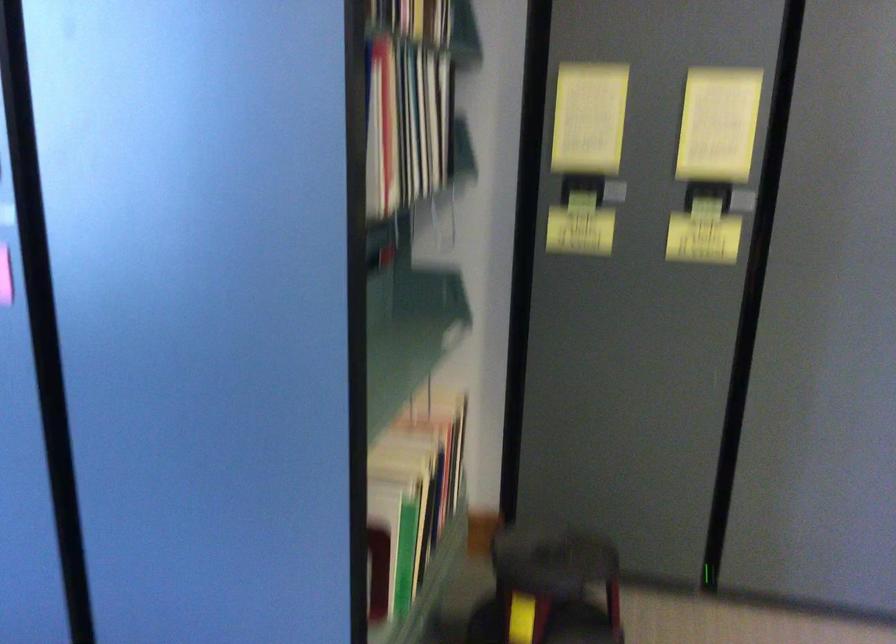
Where is `book`? This screenshot has height=644, width=896. book is located at coordinates (416, 489).